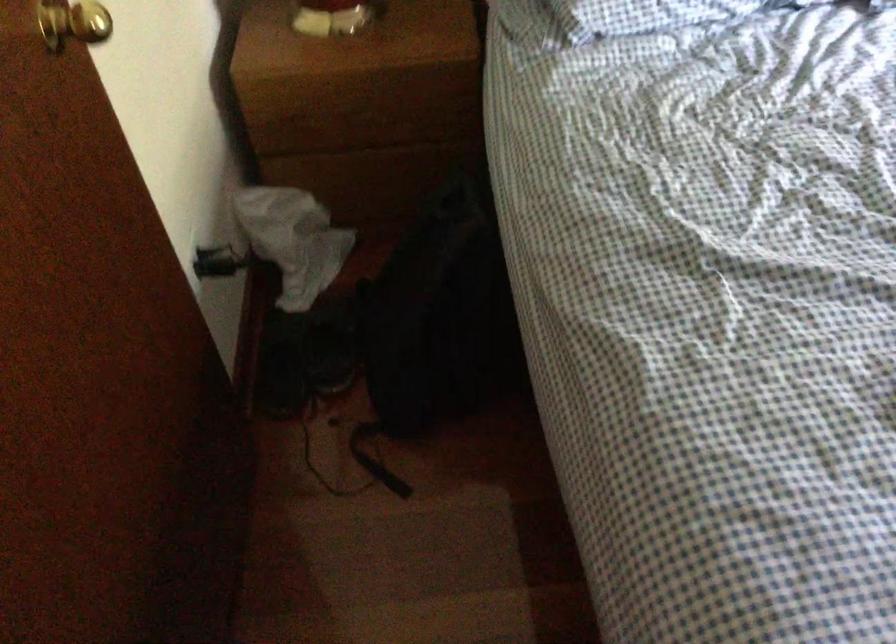
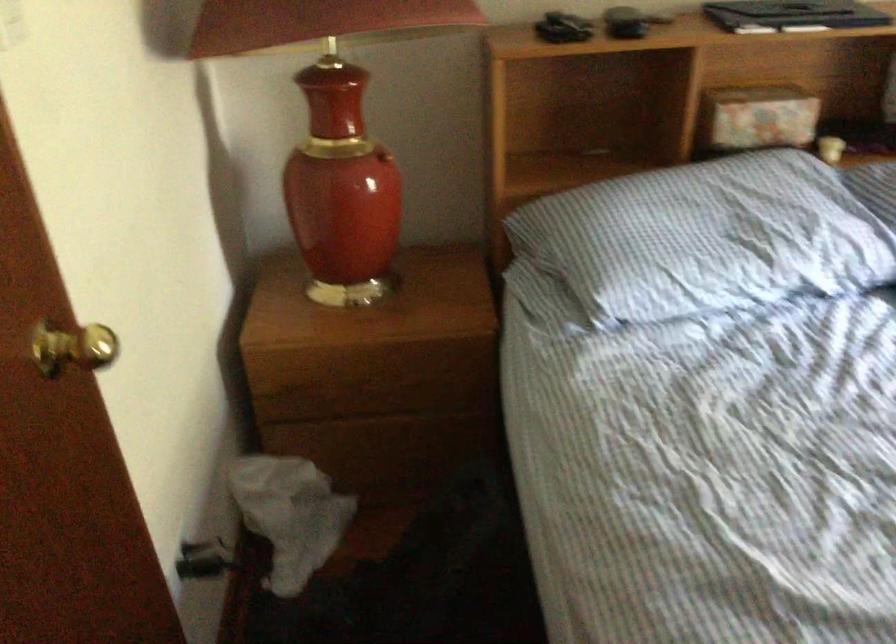
The point at (293, 240) is marked in the first image. Where is the corresponding point in the second image?

(289, 515)